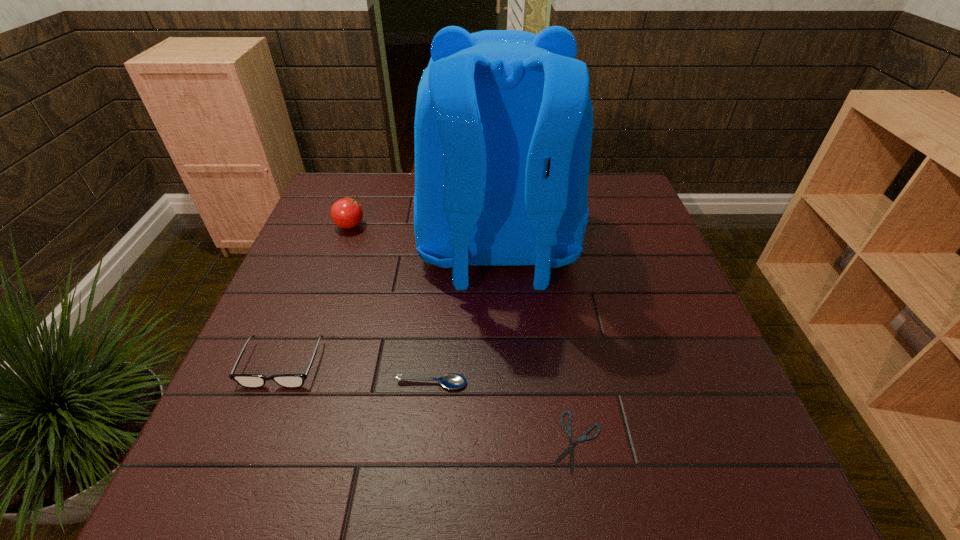
What are the coordinates of `the closest object relative to the shortest object` in the screenshot? It's located at coord(451,381).

Identify the location of vacant point that satisfies the following two spatial constraints: 1. on the front-facing side of the third tallest object; 2. on the left side of the shears. The image size is (960, 540). (252, 441).

In order to click on vacant space that satisfies the following two spatial constraints: 1. on the front side of the apple; 2. on the right side of the second shortest object in this screenshot , I will do `click(294, 383)`.

Locate an element on the screen. free location that satisfies the following two spatial constraints: 1. on the front side of the fourth shortest object; 2. on the right side of the soupspoon is located at coordinates (294, 383).

Identify the location of free space that satisfies the following two spatial constraints: 1. on the front-facing side of the fourth tallest object; 2. on the left side of the spectacles. click(275, 383).

This screenshot has height=540, width=960. What are the coordinates of `free spot that satisfies the following two spatial constraints: 1. on the back of the shortest object; 2. on the right side of the tallest object` in the screenshot? It's located at (507, 441).

Find the location of a particular element. The height and width of the screenshot is (540, 960). vacant space that satisfies the following two spatial constraints: 1. on the back of the backpack; 2. on the right side of the shears is located at coordinates (507, 441).